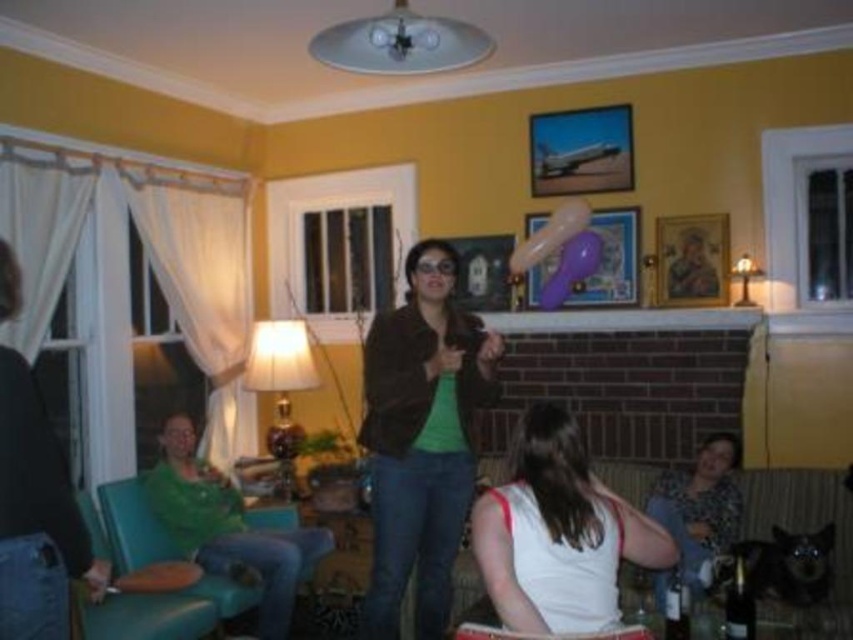
Who is lower down, white fabric tank top at lower center or wooden picture frame at center?

white fabric tank top at lower center is lower down.

Who is higher up, white fabric tank top at lower center or wooden picture frame at center?

wooden picture frame at center is higher up.

Does point (556, 524) come in front of point (482, 241)?

Yes, point (556, 524) is closer to viewer.

Image resolution: width=853 pixels, height=640 pixels. Identify the location of white fabric tank top at lower center. (558, 532).

Is wooden framed portrait at upper right taller than matte plastic picture frame at upper center?

In fact, wooden framed portrait at upper right may be shorter than matte plastic picture frame at upper center.

Is wooden framed portrait at upper right further to camera compared to matte plastic picture frame at upper center?

No.

Identify the location of wooden framed portrait at upper right. Image resolution: width=853 pixels, height=640 pixels. (691, 259).

Who is more distant from viewer, (454, 362) or (686, 243)?

Positioned behind is point (686, 243).

Where is `matte brown jacket at center`? The image size is (853, 640). matte brown jacket at center is located at coordinates (421, 440).

Who is more forward, (461, 378) or (654, 294)?

Point (461, 378)

The height and width of the screenshot is (640, 853). What are the coordinates of `matte brown jacket at center` in the screenshot? It's located at (421, 440).